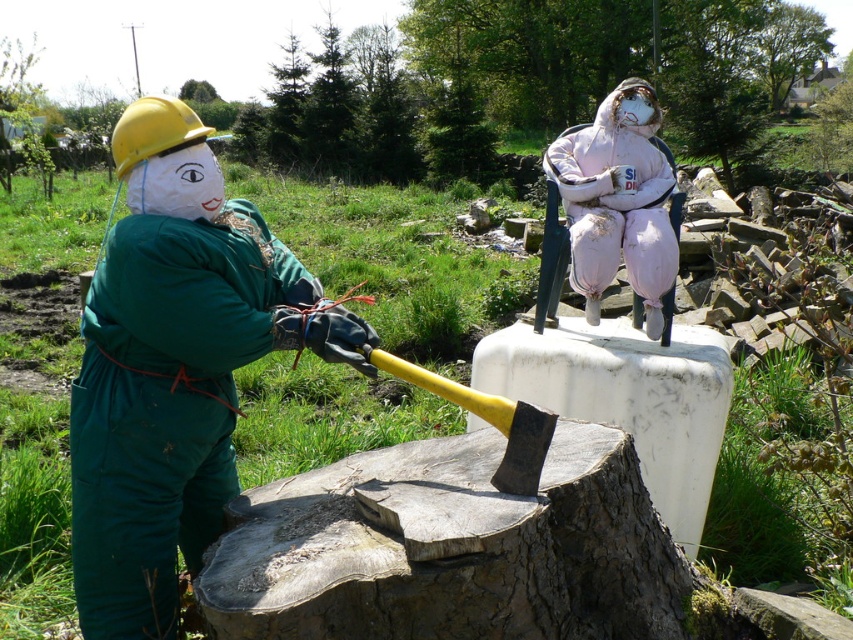
The image size is (853, 640). Identify the location of green fabric figure at left. (173, 368).

Between green fabric figure at left and pink fabric figure at upper center, which one appears on the right side from the viewer's perspective?

From the viewer's perspective, pink fabric figure at upper center appears more on the right side.

The width and height of the screenshot is (853, 640). Identify the location of green fabric figure at left. (173, 368).